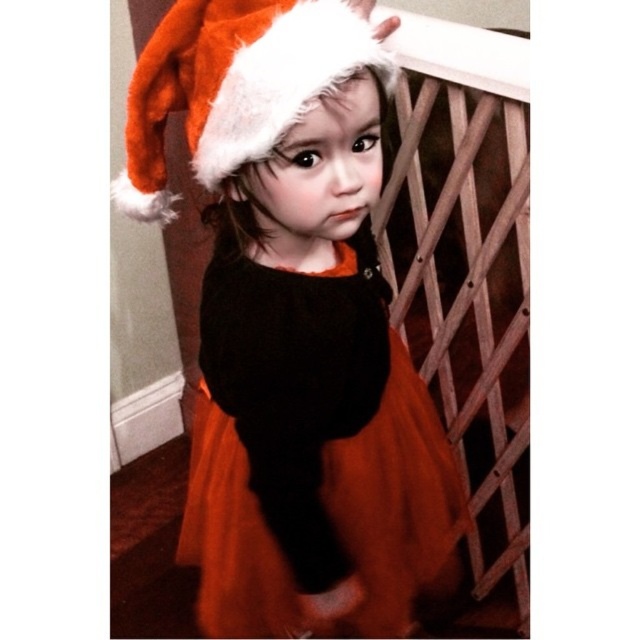
You are a photographer setting up a shoot in this scene. You need to position a light source so that it illuminates both the orange tulle dress at center and the fuzzy orange santa hat at upper center without casting shadows between them. Based on their positions, where should you place the light source?

The orange tulle dress at center is below the fuzzy orange santa hat at upper center. To avoid shadows between them, the light source should be placed above both objects, ensuring that the hat casts its shadow downward away from the dress.

You are a photographer setting up a shoot in this room. You need to place a large backdrop that covers the wooden lattice at upper right and the orange tulle dress at center. Which object requires a larger backdrop to cover properly?

The wooden lattice at upper right requires a larger backdrop because it is bigger than the orange tulle dress at center.